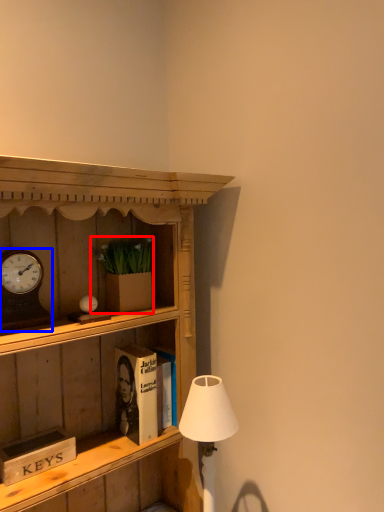
Question: Which point is further to the camera, houseplant (highlighted by a red box) or clock (highlighted by a blue box)?

Choices:
 (A) houseplant
 (B) clock

Answer: (A)